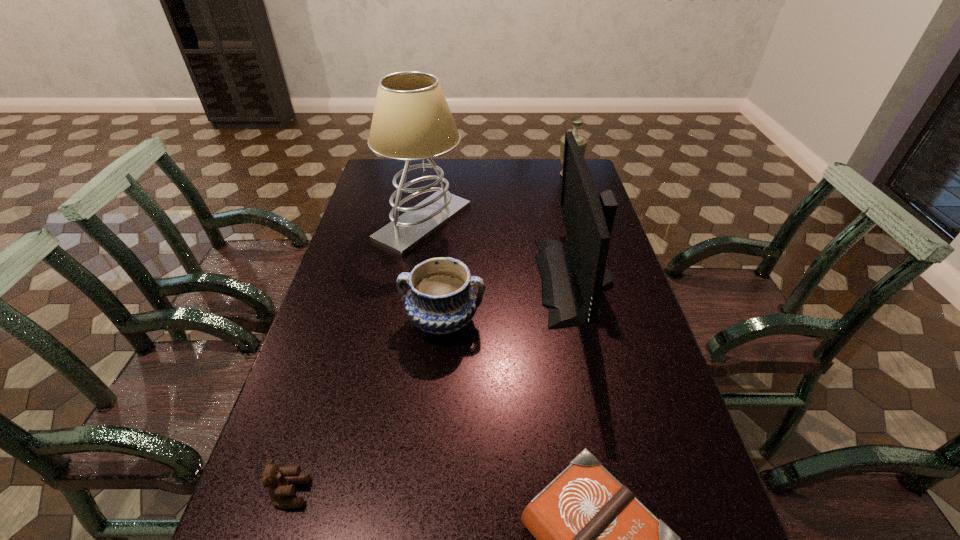
What are the coordinates of `free region that satisfies the following two spatial constraints: 1. on the front side of the pottery; 2. on the face of the teddy bear` in the screenshot? It's located at (428, 493).

Image resolution: width=960 pixels, height=540 pixels. In order to click on free spot that satisfies the following two spatial constraints: 1. on the back side of the third tallest object; 2. on the left side of the tallest object in this screenshot , I will do `click(431, 175)`.